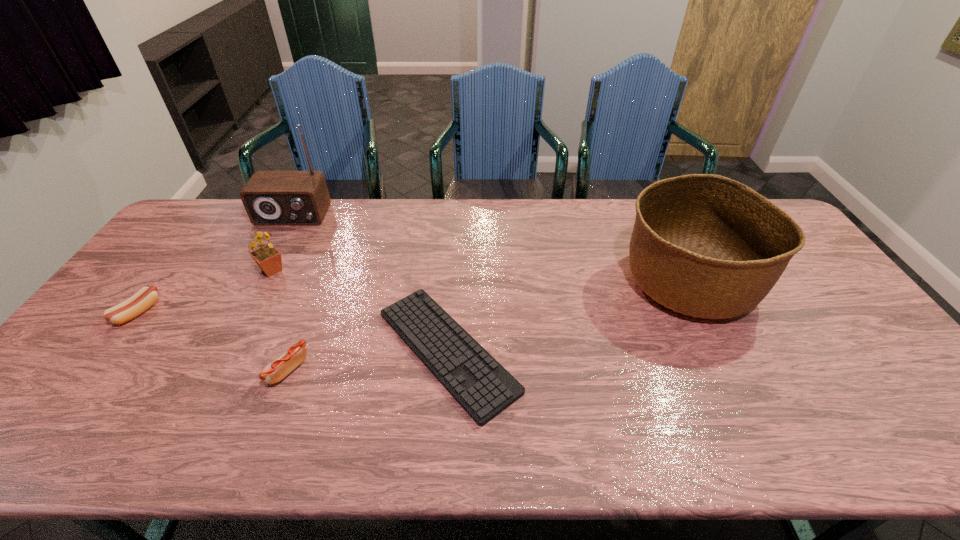
Where is `free spot between the radio receiver and the basket`? free spot between the radio receiver and the basket is located at coordinates (490, 248).

Locate an element on the screen. vacant area that lies between the sunflower and the computer keyboard is located at coordinates (360, 310).

You are a GUI agent. You are given a task and a screenshot of the screen. Output one action in this format:
    pyautogui.click(x=<x>, y=<y>)
    Task: Click on the free space between the rightmost object and the third object from right to left
    The height and width of the screenshot is (540, 960).
    Given the screenshot: What is the action you would take?
    pyautogui.click(x=488, y=326)

Identify which object is the fifth nearest to the farthest object. Please provide its 2D coordinates. Your answer should be formatted as a tuple, i.e. [(x, y)], where the tuple contains the x and y coordinates of a point satisfying the conditions above.

[(704, 245)]

Locate an element on the screen. The image size is (960, 540). object that can be found as the second closest to the basket is located at coordinates (291, 358).

Find the location of `vacant space that satisfies the following two spatial constraints: 1. on the front-facing side of the radio receiver; 2. on the left side of the third object from right to left`. vacant space that satisfies the following two spatial constraints: 1. on the front-facing side of the radio receiver; 2. on the left side of the third object from right to left is located at coordinates (210, 369).

You are a GUI agent. You are given a task and a screenshot of the screen. Output one action in this format:
    pyautogui.click(x=<x>, y=<y>)
    Task: Click on the free space that satisfies the following two spatial constraints: 1. on the front-facing side of the rightmost object; 2. on the left side of the farthest object
    This screenshot has height=540, width=960.
    Given the screenshot: What is the action you would take?
    pyautogui.click(x=257, y=282)

At what (x,y) coordinates should I click in order to perform the action: click on free space that satisfies the following two spatial constraints: 1. at the front of the rightmost object with flowers visible; 2. on the left side of the third tallest object. Please return your answer as a coordinate pair (x, y). Looking at the image, I should click on (266, 282).

Where is `vacant space that satisfies the following two spatial constraints: 1. on the front-facing side of the right sausage; 2. on the left side of the radio receiver`? This screenshot has width=960, height=540. vacant space that satisfies the following two spatial constraints: 1. on the front-facing side of the right sausage; 2. on the left side of the radio receiver is located at coordinates (210, 369).

This screenshot has height=540, width=960. I want to click on free spot that satisfies the following two spatial constraints: 1. on the back side of the nearer sausage; 2. at the front of the sunflower with flowers visible, so click(x=325, y=270).